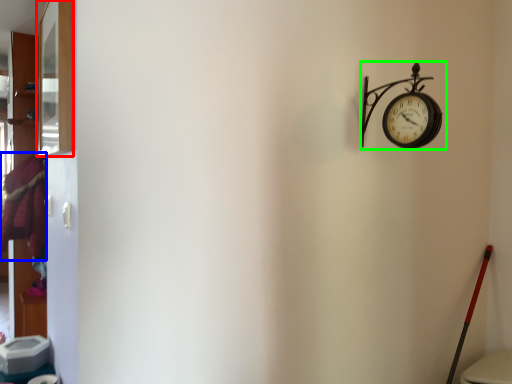
Question: Estimate the real-world distances between objects in this image. Which object is farther from window (highlighted by a red box), laundry (highlighted by a blue box) or wall clock (highlighted by a green box)?

Choices:
 (A) laundry
 (B) wall clock

Answer: (A)